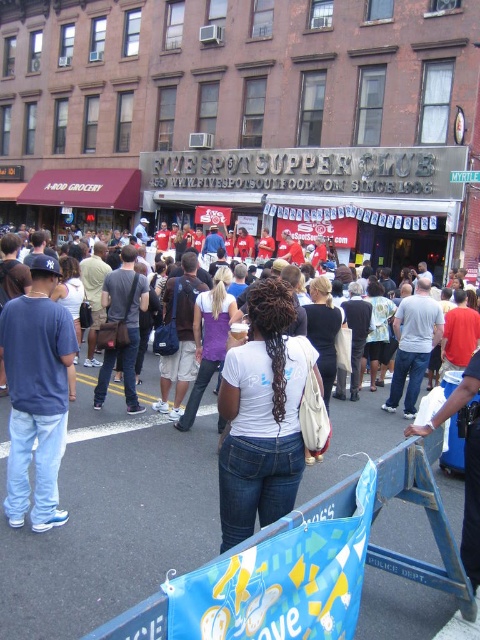
You are a photographer standing in front of the Five Spot Supper Club. You notice a person wearing a white matte shirt at center and matte blue jeans at left. Which clothing item is positioned lower on their body?

The white matte shirt at center is located below the matte blue jeans at left, so the white matte shirt at center is positioned lower on their body.

You are standing in front of the Five Spot Supper Club and want to take a photo that includes both the sign above the entrance and the crowd in front of the building. Which of the two points, point (282, 332) or point (24, 428), should you focus on first to ensure both elements are in clear view?

You should focus on point (282, 332) first because it is closer to the viewer than point (24, 428). This will help ensure both the sign above the entrance and the crowd are in clear view.